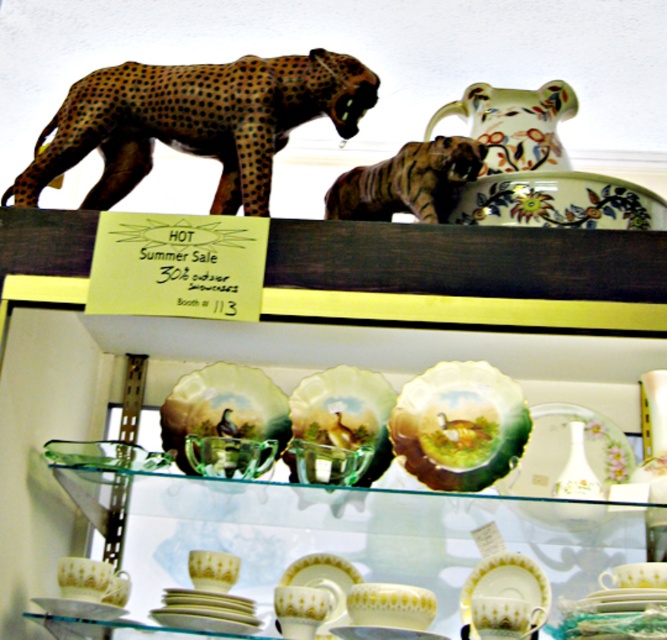
Question: Observing the image, what is the correct spatial positioning of porcelain plates at upper center in reference to spotted wooden cheetah at upper left?

Choices:
 (A) left
 (B) right

Answer: (B)

Question: Considering the relative positions of porcelain plates at upper center and green glazed plate at center in the image provided, where is porcelain plates at upper center located with respect to green glazed plate at center?

Choices:
 (A) below
 (B) above

Answer: (B)

Question: Which point is closer to the camera?

Choices:
 (A) striped ceramic tiger at upper center
 (B) green glazed plate at center
 (C) floral ceramic pitcher at upper right
 (D) green glass bowl at center

Answer: (B)

Question: Which of the following is the closest to the observer?

Choices:
 (A) (291, 451)
 (B) (436, 192)

Answer: (A)

Question: Which object appears closest to the camera in this image?

Choices:
 (A) porcelain plates at upper center
 (B) green glazed plate at center
 (C) transparent glass bowl at center
 (D) green glass bowl at center

Answer: (A)

Question: Can you confirm if green glass bowl at center is positioned above porcelain plate at lower center?

Choices:
 (A) no
 (B) yes

Answer: (B)